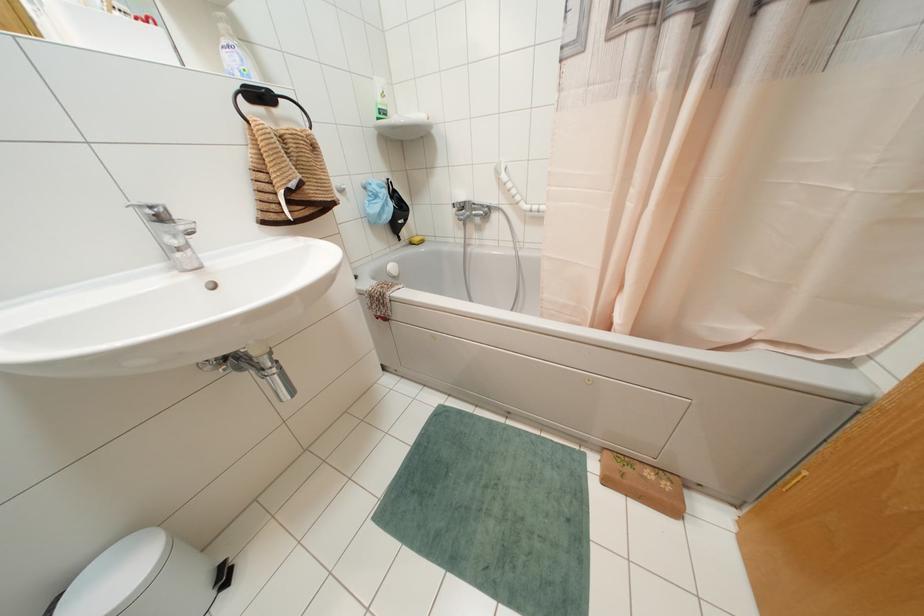
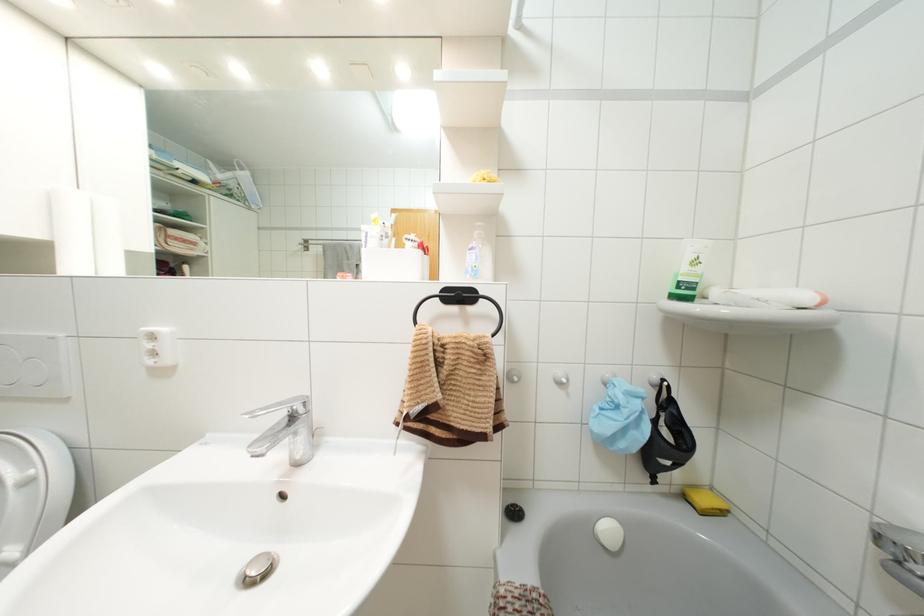
In the second image, find the point that corresponds to [382,94] in the first image.

(695, 262)